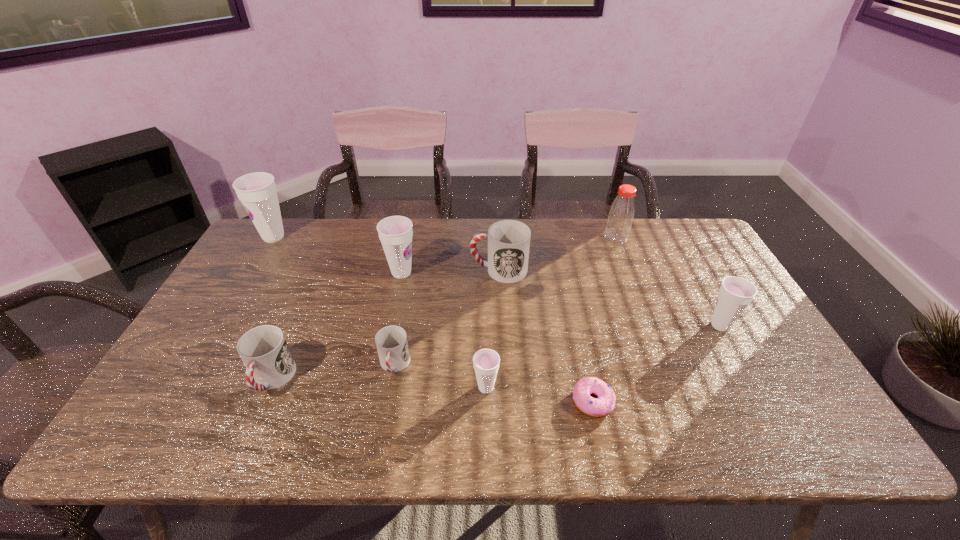
At what (x,y) coordinates should I click in order to perform the action: click on object at the left edge. Please return your answer as a coordinate pair (x, y). Image resolution: width=960 pixels, height=540 pixels. Looking at the image, I should click on (257, 191).

Locate an element on the screen. The width and height of the screenshot is (960, 540). object at the right edge is located at coordinates (735, 294).

Where is `object that is at the far left corner`? The height and width of the screenshot is (540, 960). object that is at the far left corner is located at coordinates (257, 191).

Image resolution: width=960 pixels, height=540 pixels. In the image, there is a desktop. In order to click on vacant space at the far edge in this screenshot , I will do `click(426, 259)`.

This screenshot has width=960, height=540. Identify the location of vacant region at the near edge of the desktop. (271, 434).

Find the location of `free spot at the right edge of the desktop`. free spot at the right edge of the desktop is located at coordinates (705, 284).

This screenshot has height=540, width=960. In the image, there is a desktop. What are the coordinates of `free space at the far left corner` in the screenshot? It's located at (245, 253).

In the image, there is a desktop. Identify the location of free space at the far right corner. The width and height of the screenshot is (960, 540). (702, 241).

At what (x,y) coordinates should I click in order to perform the action: click on free spot between the second farthest purple cup and the fourth farthest cup. Please return your answer as a coordinate pair (x, y). Looking at the image, I should click on (561, 299).

Where is `vacant space that is in between the shortest object and the second smallest red cup`? vacant space that is in between the shortest object and the second smallest red cup is located at coordinates (432, 390).